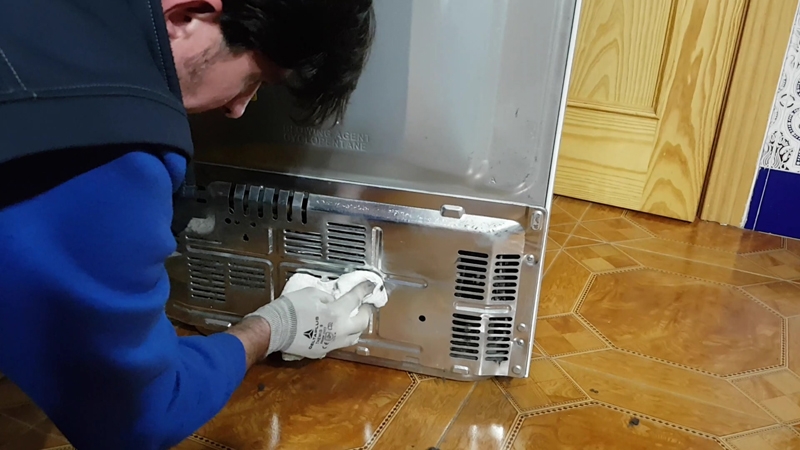
I want to click on floor, so click(x=578, y=319).